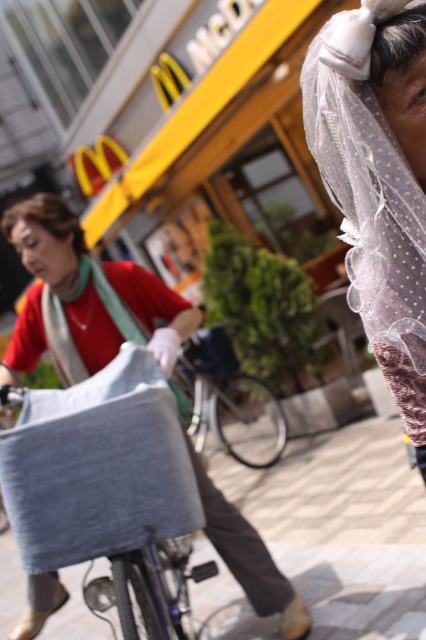
Is matte gray fabric bag at center above metallic silver bicycle at center?

Indeed, matte gray fabric bag at center is positioned over metallic silver bicycle at center.

Is matte gray fabric bag at center in front of metallic silver bicycle at center?

Yes, it is.

Is point (215, 509) closer to viewer compared to point (227, 429)?

Yes, it is.

Find the location of a particular element. This screenshot has height=640, width=426. matte gray fabric bag at center is located at coordinates (85, 298).

Consider the image. Which is below, gray fabric bag at center or metallic silver bicycle at center?

metallic silver bicycle at center is lower down.

Is point (163, 394) positioned after point (244, 392)?

No, (163, 394) is in front of (244, 392).

Locate an element on the screen. The height and width of the screenshot is (640, 426). gray fabric bag at center is located at coordinates pyautogui.click(x=97, y=467).

This screenshot has height=640, width=426. I want to click on gray fabric bag at center, so click(x=97, y=467).

Between gray fabric bag at center and matte gray fabric bag at center, which one is positioned lower?

gray fabric bag at center is below.

Who is positioned more to the right, gray fabric bag at center or matte gray fabric bag at center?

gray fabric bag at center

The width and height of the screenshot is (426, 640). I want to click on gray fabric bag at center, so click(97, 467).